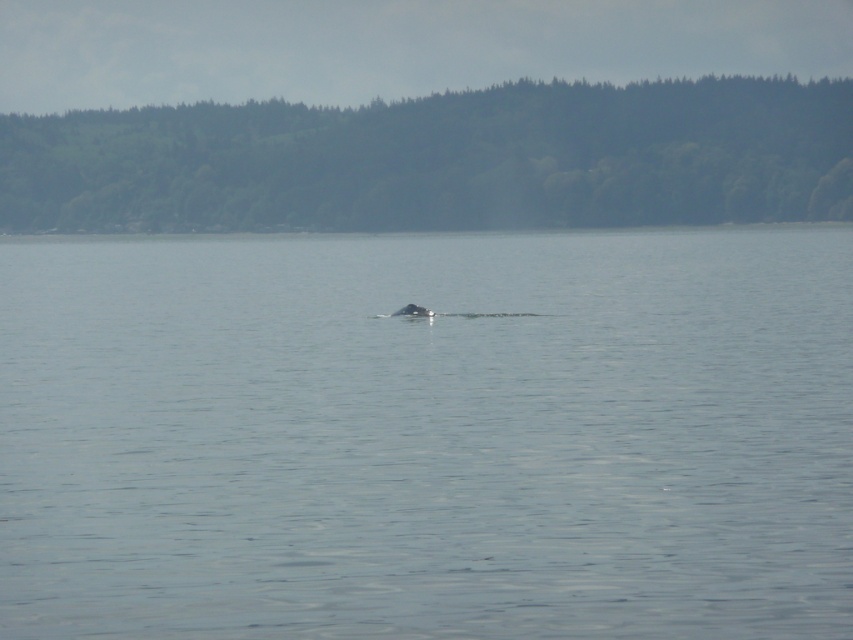
Question: Which point appears farthest from the camera in this image?

Choices:
 (A) (392, 316)
 (B) (424, 365)

Answer: (A)

Question: Does clear water at center appear on the left side of gray matte whale at center?

Choices:
 (A) yes
 (B) no

Answer: (A)

Question: Is the position of clear water at center more distant than that of gray matte whale at center?

Choices:
 (A) yes
 (B) no

Answer: (B)

Question: Which object appears farthest from the camera in this image?

Choices:
 (A) gray matte whale at center
 (B) clear water at center

Answer: (A)

Question: Can you confirm if clear water at center is thinner than gray matte whale at center?

Choices:
 (A) yes
 (B) no

Answer: (B)